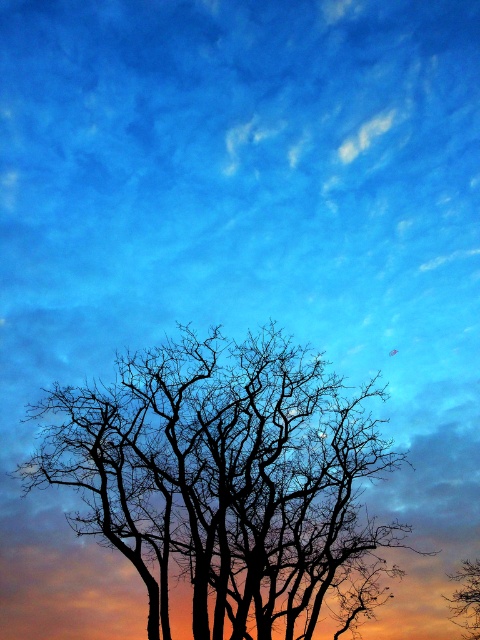
Question: Among these points, which one is farthest from the camera?

Choices:
 (A) (465, 616)
 (B) (257, 387)

Answer: (A)

Question: Does silhouette bark tree at center have a greater width compared to silhouette bare tree at center?

Choices:
 (A) yes
 (B) no

Answer: (A)

Question: In this image, where is silhouette bark tree at center located relative to silhouette bare tree at center?

Choices:
 (A) below
 (B) above

Answer: (B)

Question: Does silhouette bark tree at center appear over silhouette bare tree at center?

Choices:
 (A) no
 (B) yes

Answer: (B)